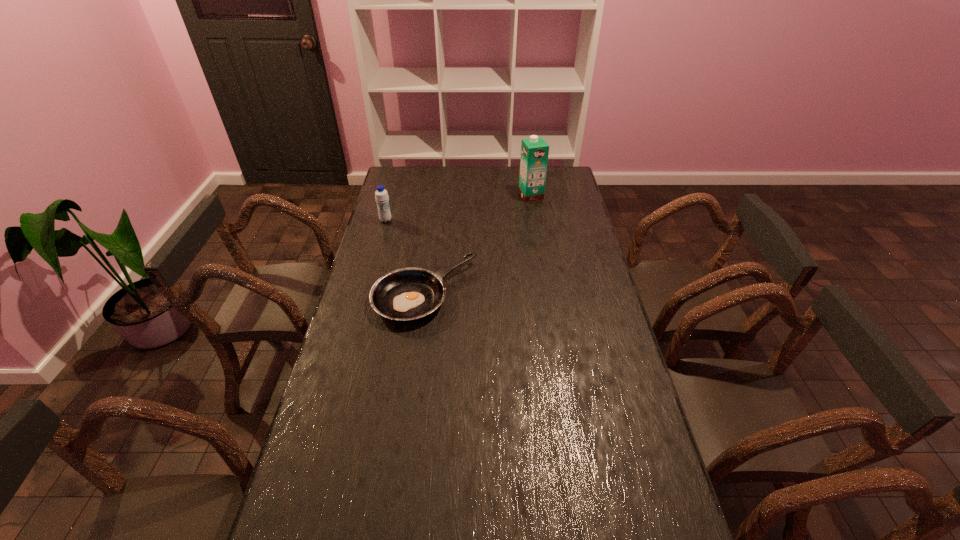
At what (x,y) coordinates should I click in order to perform the action: click on carton. Please return your answer as a coordinate pair (x, y). The image size is (960, 540). Looking at the image, I should click on (534, 151).

Identify the location of the farthest object. (534, 151).

Image resolution: width=960 pixels, height=540 pixels. Find the location of `water bottle`. water bottle is located at coordinates (381, 195).

Image resolution: width=960 pixels, height=540 pixels. What are the coordinates of `the second nearest object` in the screenshot? It's located at (381, 195).

At what (x,y) coordinates should I click in order to perform the action: click on the nearest object. Please return your answer as a coordinate pair (x, y). Looking at the image, I should click on (406, 294).

What are the coordinates of `frying pan` in the screenshot? It's located at (406, 294).

Identify the location of vacant area situated on the left of the rightmost object. The height and width of the screenshot is (540, 960). (439, 195).

Where is `vacant space located on the front of the second tallest object`? vacant space located on the front of the second tallest object is located at coordinates (375, 258).

Identify the location of blank space located on the front of the nearest object. The image size is (960, 540). (415, 377).

You are a GUI agent. You are given a task and a screenshot of the screen. Output one action in this format:
    pyautogui.click(x=<x>, y=<y>)
    Task: Click on the object located at the far edge
    
    Given the screenshot: What is the action you would take?
    pyautogui.click(x=534, y=151)